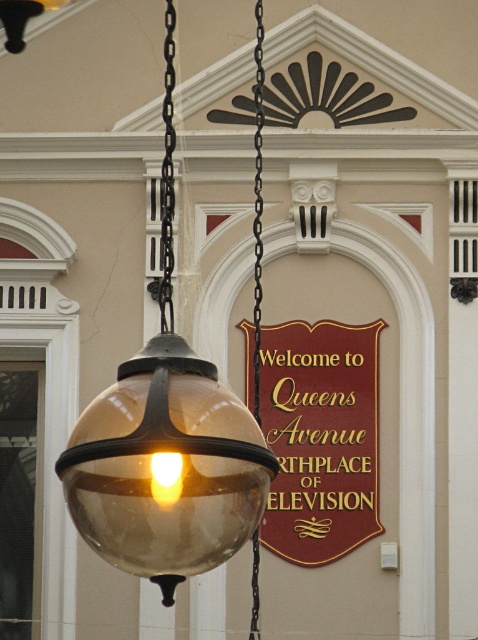
Is translucent glass globe at center bigger than maroon polished wood sign at center?

Correct, translucent glass globe at center is larger in size than maroon polished wood sign at center.

Who is more forward, (88, 515) or (367, 528)?

Point (88, 515) is in front.

Does point (196, 461) come behind point (293, 513)?

That is False.

Find the location of a particular element. This screenshot has height=640, width=478. translucent glass globe at center is located at coordinates (166, 444).

Does point (154, 422) come farther from viewer compared to point (166, 268)?

No, (154, 422) is in front of (166, 268).

Is point (175, 445) closer to viewer compared to point (164, 170)?

Yes, point (175, 445) is closer to viewer.

Who is more forward, [260,68] or [162,189]?

Point [162,189]

I want to click on translucent glass globe at center, so click(x=166, y=444).

What do you see at coordinates (166, 444) in the screenshot? The image size is (478, 640). I see `translucent glass globe at center` at bounding box center [166, 444].

From the picture: Can you confirm if translucent glass globe at center is positioned to the right of black metal chain at left?

No, translucent glass globe at center is not to the right of black metal chain at left.

Which is in front, point (107, 529) or point (260, 186)?

Point (107, 529) is in front.

You are a GUI agent. You are given a task and a screenshot of the screen. Output one action in this format:
    pyautogui.click(x=<x>, y=<y>)
    Task: Click on the translucent glass globe at center
    The height and width of the screenshot is (640, 478).
    Given the screenshot: What is the action you would take?
    click(166, 444)